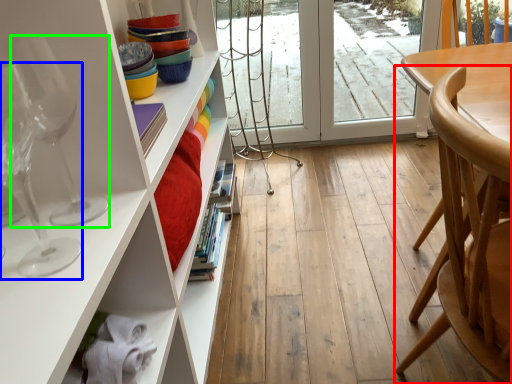
Question: Which object is positioned farthest from chair (highlighted by a red box)? Select from wine glass (highlighted by a blue box) and wine glass (highlighted by a green box).

Choices:
 (A) wine glass
 (B) wine glass

Answer: (A)